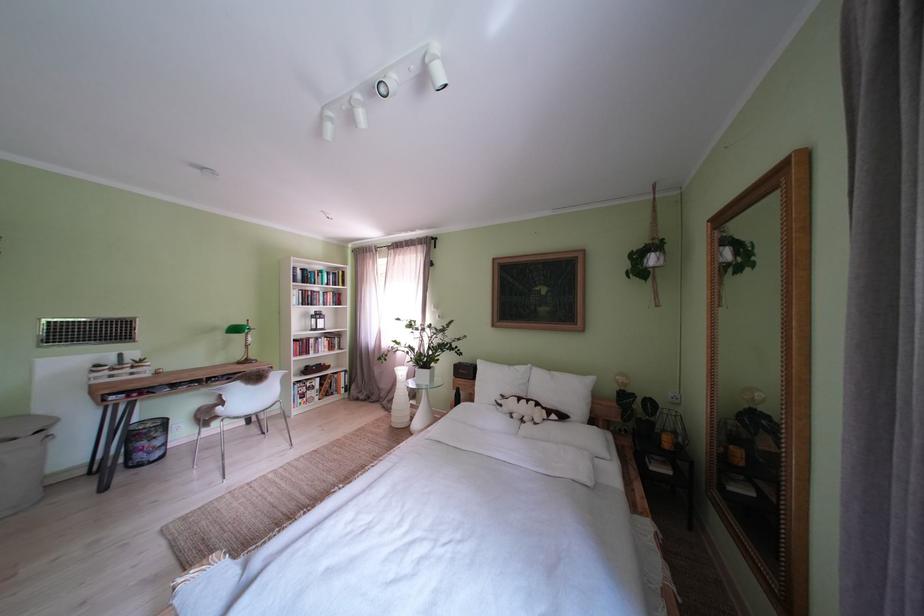
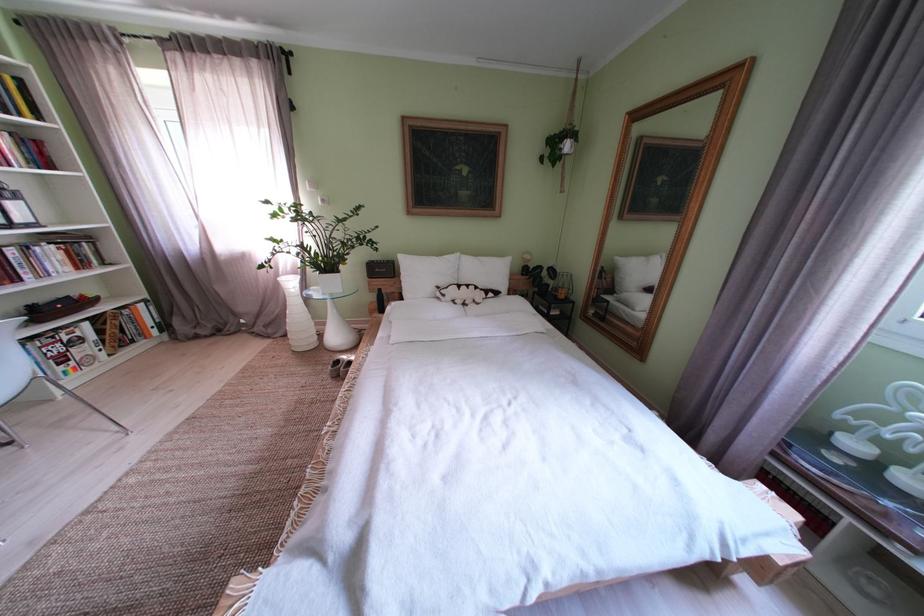
In the second image, find the point that corresponds to [324,392] in the first image.

(92, 344)